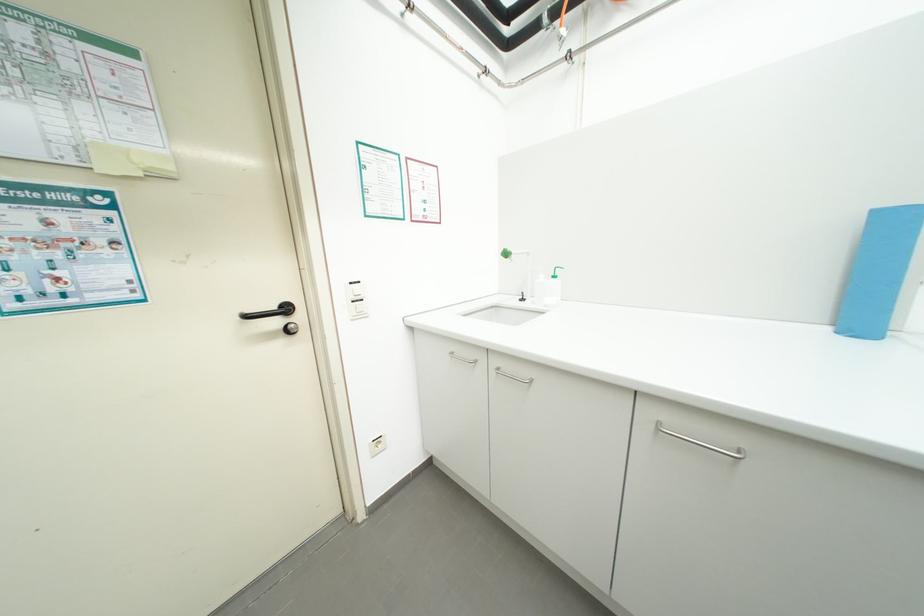
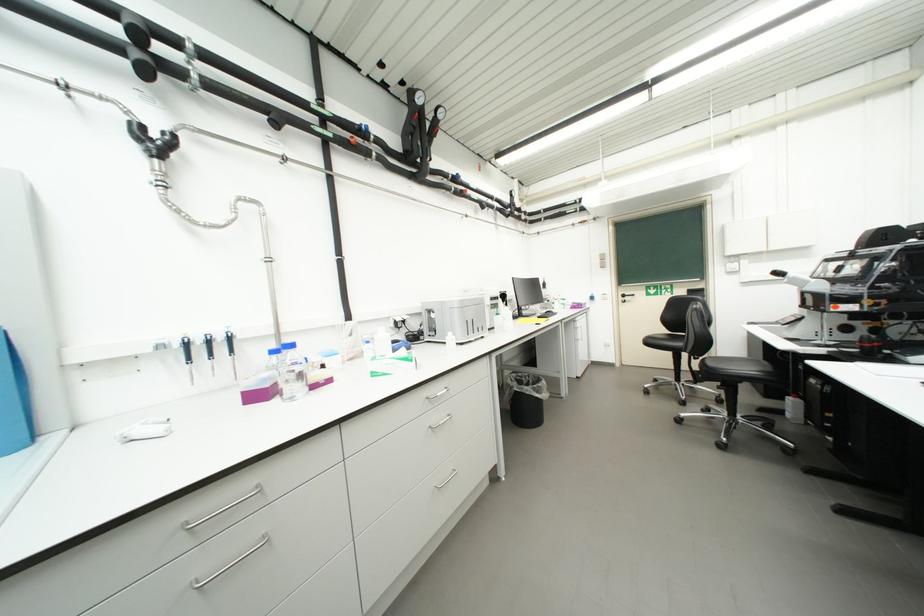
Question: Based on the continuous images, in which direction is the camera rotating? Reply with the corresponding letter.

Choices:
 (A) Left
 (B) Right
 (C) Up
 (D) Down

Answer: (B)